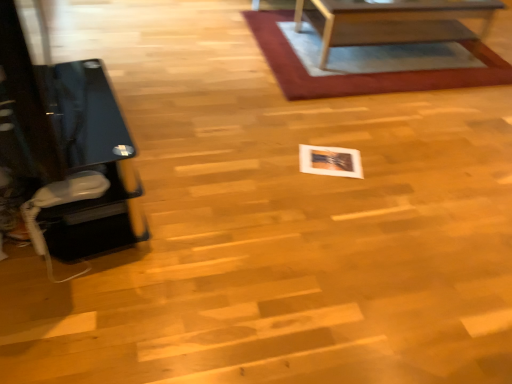
Find the location of a particular element. free location in front of black glass table at left is located at coordinates (84, 317).